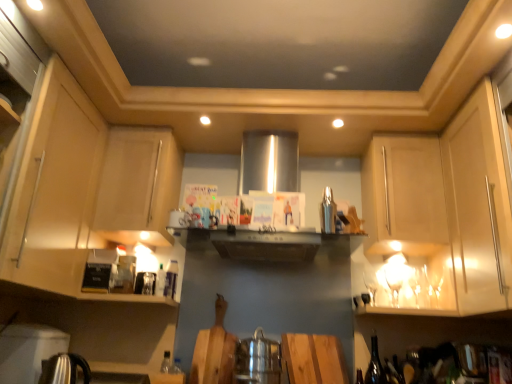
Identify the location of matte wood cabinet at upper left, which is the second cabinetry in left-to-right order. (138, 186).

This screenshot has width=512, height=384. What are the coordinates of `translucent plastic bottle at lower left, placed as the 2th bottle when sorted from left to right` in the screenshot? It's located at (170, 279).

The width and height of the screenshot is (512, 384). What do you see at coordinates (328, 212) in the screenshot?
I see `satin silver shaker at upper center, the third appliance positioned from the left` at bounding box center [328, 212].

Locate an element on the screen. The width and height of the screenshot is (512, 384). matte wood cabinet at left, the 1th cabinetry when ordered from left to right is located at coordinates (85, 191).

The image size is (512, 384). What do you see at coordinates (314, 359) in the screenshot? I see `wooden cutting board at center, which is the second plywood in left-to-right order` at bounding box center [314, 359].

Describe the element at coordinates (28, 351) in the screenshot. This screenshot has height=384, width=512. I see `metallic silver kettle at lower left, positioned as the 1th appliance in left-to-right order` at that location.

Image resolution: width=512 pixels, height=384 pixels. What are the coordinates of `matte wood cabinet at upper left, positioned as the 4th cabinetry in right-to-left order` in the screenshot? It's located at [138, 186].

Looking at this image, is matte wood cabinet at right, the third cabinetry in the left-to-right sequence, taller than translucent plastic bottle at lower left, which appears as the first bottle when viewed from the right?

Correct, matte wood cabinet at right, the third cabinetry in the left-to-right sequence, is much taller as translucent plastic bottle at lower left, which appears as the first bottle when viewed from the right.

Based on their sizes in the image, would you say matte wood cabinet at right, the third cabinetry in the left-to-right sequence, is bigger or smaller than translucent plastic bottle at lower left, placed as the 2th bottle when sorted from left to right?

In the image, matte wood cabinet at right, the third cabinetry in the left-to-right sequence, appears to be larger than translucent plastic bottle at lower left, placed as the 2th bottle when sorted from left to right.

From the image's perspective, who appears lower, matte wood cabinet at right, placed as the third cabinetry when sorted from right to left, or translucent plastic bottle at lower left, placed as the 2th bottle when sorted from left to right?

translucent plastic bottle at lower left, placed as the 2th bottle when sorted from left to right, appears lower in the image.

Considering the sizes of objects satin silver shaker at upper center, acting as the 3th appliance starting from the bottom, and wooden cutting board at center, which appears as the first plywood when viewed from the right, in the image provided, who is wider, satin silver shaker at upper center, acting as the 3th appliance starting from the bottom, or wooden cutting board at center, which appears as the first plywood when viewed from the right,?

satin silver shaker at upper center, acting as the 3th appliance starting from the bottom, is wider.

Can you tell me how much satin silver shaker at upper center, placed as the 1th appliance when sorted from right to left, and wooden cutting board at center, which appears as the first plywood when viewed from the right, differ in facing direction?

0.984 degrees.

Does point (331, 209) appear closer or farther from the camera than point (319, 336)?

Point (331, 209) is positioned closer to the camera compared to point (319, 336).

From a real-world perspective, which object rests below the other?

wooden cutting board at center, which is the second plywood in left-to-right order, from a real-world perspective.

Between polished stainless steel kettle at lower left, which ranks as the second appliance in right-to-left order, and matte wood cabinet at right, placed as the third cabinetry when sorted from right to left, which one appears on the left side from the viewer's perspective?

polished stainless steel kettle at lower left, which ranks as the second appliance in right-to-left order.

Which point is more distant from viewer, (74, 360) or (429, 216)?

Point (429, 216)

Is polished stainless steel kettle at lower left, which is the 3th appliance in top-to-bottom order, facing towards matte wood cabinet at right, the third cabinetry in the left-to-right sequence?

No, polished stainless steel kettle at lower left, which is the 3th appliance in top-to-bottom order, is not turned towards matte wood cabinet at right, the third cabinetry in the left-to-right sequence.

Is polished stainless steel kettle at lower left, which ranks as the second appliance in right-to-left order, wider or thinner than matte wood cabinet at right, placed as the third cabinetry when sorted from right to left?

Clearly, polished stainless steel kettle at lower left, which ranks as the second appliance in right-to-left order, has less width compared to matte wood cabinet at right, placed as the third cabinetry when sorted from right to left.

Which is farther from the camera, (158, 161) or (69, 105)?

The point (158, 161) is more distant.

Is the depth of matte wood cabinet at upper left, positioned as the 4th cabinetry in right-to-left order, greater than that of matte wood cabinet at left, which is the 5th cabinetry from right to left?

Yes, matte wood cabinet at upper left, positioned as the 4th cabinetry in right-to-left order, is further from the camera.

Is there a large distance between matte wood cabinet at upper left, positioned as the 4th cabinetry in right-to-left order, and matte wood cabinet at left, the 1th cabinetry when ordered from left to right?

No.

Does matte wood cabinet at upper left, positioned as the 4th cabinetry in right-to-left order, turn towards matte wood cabinet at left, the 1th cabinetry when ordered from left to right?

Yes, matte wood cabinet at upper left, positioned as the 4th cabinetry in right-to-left order, is oriented towards matte wood cabinet at left, the 1th cabinetry when ordered from left to right.

Considering their positions, is dark brown glass bottle at lower right, the 1th wine bottle in the left-to-right sequence, located in front of or behind translucent plastic bottle at lower left, which appears as the first bottle when viewed from the right?

Visually, dark brown glass bottle at lower right, the 1th wine bottle in the left-to-right sequence, is located in front of translucent plastic bottle at lower left, which appears as the first bottle when viewed from the right.

Would you say translucent plastic bottle at lower left, which appears as the first bottle when viewed from the right, is part of dark brown glass bottle at lower right, the 2th wine bottle from the right,'s contents?

Actually, translucent plastic bottle at lower left, which appears as the first bottle when viewed from the right, is outside dark brown glass bottle at lower right, the 2th wine bottle from the right.

In the scene shown: Between dark brown glass bottle at lower right, the 1th wine bottle in the left-to-right sequence, and translucent plastic bottle at lower left, placed as the 2th bottle when sorted from left to right, which one has larger width?

Wider between the two is dark brown glass bottle at lower right, the 1th wine bottle in the left-to-right sequence.

Considering the positions of objects wooden cutting board at center, which is the second plywood in left-to-right order, and metallic silver kettle at lower left, positioned as the second appliance in bottom-to-top order, in the image provided, who is behind, wooden cutting board at center, which is the second plywood in left-to-right order, or metallic silver kettle at lower left, positioned as the second appliance in bottom-to-top order,?

Positioned behind is wooden cutting board at center, which is the second plywood in left-to-right order.

Can you confirm if wooden cutting board at center, which is the second plywood in left-to-right order, is smaller than metallic silver kettle at lower left, acting as the 3th appliance starting from the right?

Yes, wooden cutting board at center, which is the second plywood in left-to-right order, is smaller than metallic silver kettle at lower left, acting as the 3th appliance starting from the right.

Which is less distant, (334, 351) or (11, 336)?

The point (11, 336) is in front.

From the picture: From a real-world perspective, is dark brown glass bottle at lower right, the 2th wine bottle from the right, physically located above or below matte wood cabinet at right, placed as the third cabinetry when sorted from right to left?

Clearly, from a real-world perspective, dark brown glass bottle at lower right, the 2th wine bottle from the right, is below matte wood cabinet at right, placed as the third cabinetry when sorted from right to left.

From the image's perspective, which wine bottle is the 1st one below the matte wood cabinet at right, the third cabinetry in the left-to-right sequence? Please provide its 2D coordinates.

[(375, 365)]

Which point is more distant from viewer, (373, 357) or (385, 228)?

The point (373, 357) is farther from the camera.

From the image's perspective, who appears lower, dark brown glass bottle at lower right, the 1th wine bottle in the left-to-right sequence, or matte wood cabinet at right, placed as the third cabinetry when sorted from right to left?

dark brown glass bottle at lower right, the 1th wine bottle in the left-to-right sequence, is shown below in the image.

In order to click on bottle that is the 1st one below the matte wood cabinet at right, the third cabinetry in the left-to-right sequence (from a real-world perspective) in this screenshot , I will do `click(170, 279)`.

There is a satin silver shaker at upper center, the first appliance viewed from the top. Where is `the 2nd plywood below it (from the image's perspective)`? Image resolution: width=512 pixels, height=384 pixels. the 2nd plywood below it (from the image's perspective) is located at coordinates (314, 359).

Considering their positions, is wooden cutting board at center, which is the second plywood in left-to-right order, positioned further to wooden cutting board at center, acting as the 2th plywood starting from the right, than matte wood cabinet at right, the third cabinetry in the left-to-right sequence?

matte wood cabinet at right, the third cabinetry in the left-to-right sequence, is further to wooden cutting board at center, acting as the 2th plywood starting from the right.

Estimate the real-world distances between objects in this image. Which object is closer to wooden cutting board at center, acting as the 2th plywood starting from the right, translucent glass bottle at lower center, which appears as the 2th bottle when viewed from the right, or dark brown glass bottle at lower right, the 2th wine bottle from the right?

Based on the image, translucent glass bottle at lower center, which appears as the 2th bottle when viewed from the right, appears to be nearer to wooden cutting board at center, acting as the 2th plywood starting from the right.

Estimate the real-world distances between objects in this image. Which object is closer to matte wood cabinet at right, the third cabinetry in the left-to-right sequence, matte wood cabinet at upper left, which is the second cabinetry in left-to-right order, or metallic silver kettle at lower left, positioned as the 1th appliance in left-to-right order?

matte wood cabinet at upper left, which is the second cabinetry in left-to-right order.

Estimate the real-world distances between objects in this image. Which object is further from matte wood cabinet at right, which is the fifth cabinetry in left-to-right order, translucent glass wine bottle at lower right, which appears as the second wine bottle when viewed from the left, or polished stainless steel kettle at lower left, acting as the second appliance starting from the left?

polished stainless steel kettle at lower left, acting as the second appliance starting from the left, is further to matte wood cabinet at right, which is the fifth cabinetry in left-to-right order.

From the image, which object appears to be nearer to matte wood cabinet at right, which ranks as the 1th cabinetry in right-to-left order, wooden cutting board at center, acting as the 2th plywood starting from the right, or polished stainless steel kettle at lower left, acting as the second appliance starting from the left?

wooden cutting board at center, acting as the 2th plywood starting from the right.

Looking at the image, which one is located closer to matte wood cabinet at left, the 1th cabinetry when ordered from left to right, satin silver shaker at upper center, the third appliance positioned from the left, or translucent glass bottle at lower center, which appears as the 2th bottle when viewed from the right?

Based on the image, translucent glass bottle at lower center, which appears as the 2th bottle when viewed from the right, appears to be nearer to matte wood cabinet at left, the 1th cabinetry when ordered from left to right.

Estimate the real-world distances between objects in this image. Which object is closer to dark brown glass bottle at lower right, the 1th wine bottle in the left-to-right sequence, wooden cutting board at center, which appears as the first plywood when viewed from the right, or polished stainless steel kettle at lower left, which is the 3th appliance in top-to-bottom order?

wooden cutting board at center, which appears as the first plywood when viewed from the right.

Considering their positions, is wooden cutting board at center, acting as the 2th plywood starting from the right, positioned closer to satin silver shaker at upper center, acting as the 3th appliance starting from the bottom, than translucent plastic bottle at lower left, which appears as the first bottle when viewed from the right?

Based on the image, wooden cutting board at center, acting as the 2th plywood starting from the right, appears to be nearer to satin silver shaker at upper center, acting as the 3th appliance starting from the bottom.

Identify the location of bottle between translucent glass bottle at lower center, which appears as the 2th bottle when viewed from the right, and matte wood cabinet at right, which is the 2th cabinetry in right-to-left order, from left to right. Image resolution: width=512 pixels, height=384 pixels. (170, 279).

Locate an element on the screen. This screenshot has height=384, width=512. appliance between matte wood cabinet at upper left, positioned as the 4th cabinetry in right-to-left order, and matte wood cabinet at right, which ranks as the 1th cabinetry in right-to-left order, from left to right is located at coordinates 328,212.

This screenshot has height=384, width=512. Find the location of `appliance between metallic silver kettle at lower left, positioned as the second appliance in bottom-to-top order, and translucent plastic bottle at lower left, which appears as the first bottle when viewed from the right, in the horizontal direction`. appliance between metallic silver kettle at lower left, positioned as the second appliance in bottom-to-top order, and translucent plastic bottle at lower left, which appears as the first bottle when viewed from the right, in the horizontal direction is located at coordinates (64, 369).

Find the location of `plywood located between wooden cutting board at center, acting as the 2th plywood starting from the right, and matte wood cabinet at right, placed as the third cabinetry when sorted from right to left, in the left-right direction`. plywood located between wooden cutting board at center, acting as the 2th plywood starting from the right, and matte wood cabinet at right, placed as the third cabinetry when sorted from right to left, in the left-right direction is located at coordinates (314, 359).